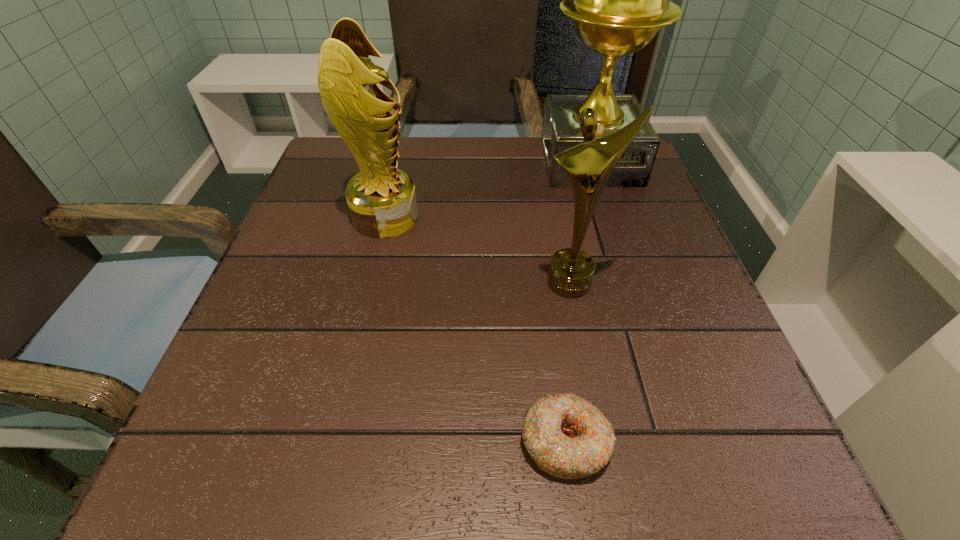
Identify the location of free space between the farthest award and the nearest object. (577, 301).

You are a GUI agent. You are given a task and a screenshot of the screen. Output one action in this format:
    pyautogui.click(x=<x>, y=<y>)
    Task: Click on the empty space that is in between the shortest object and the leftmost object
    
    Given the screenshot: What is the action you would take?
    pyautogui.click(x=475, y=329)

Locate which object is the third closest to the second nearest object. Please provide its 2D coordinates. Your answer should be formatted as a tuple, i.e. [(x, y)], where the tuple contains the x and y coordinates of a point satisfying the conditions above.

[(619, 0)]

Locate an element on the screen. The image size is (960, 540). the second closest object to the farthest object is located at coordinates (382, 202).

Locate which award is the second closest to the nearest object. Please provide its 2D coordinates. Your answer should be formatted as a tuple, i.e. [(x, y)], where the tuple contains the x and y coordinates of a point satisfying the conditions above.

[(382, 202)]

Locate an element on the screen. The image size is (960, 540). the closest award relative to the leftmost object is located at coordinates (588, 165).

Image resolution: width=960 pixels, height=540 pixels. In order to click on free region that satisfies the following two spatial constraints: 1. on the front-facing side of the farthest award; 2. on the front-facing side of the second nearest object in this screenshot , I will do tap(629, 282).

Locate an element on the screen. vacant area in the image that satisfies the following two spatial constraints: 1. on the front-facing side of the farthest award; 2. on the front-facing side of the nearest award is located at coordinates (629, 282).